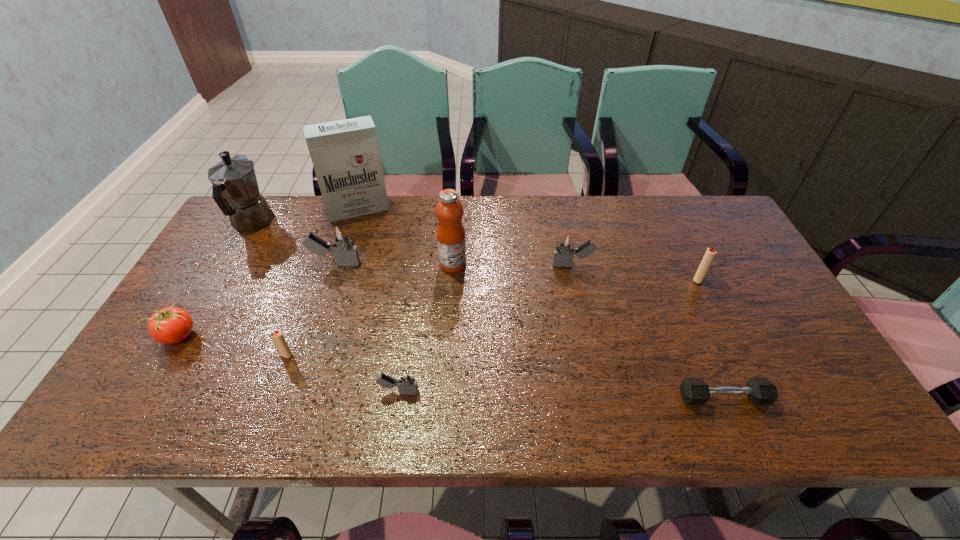
Where is `the fourth farthest igniter`? This screenshot has height=540, width=960. the fourth farthest igniter is located at coordinates tap(277, 337).

Locate an element on the screen. Image resolution: width=960 pixels, height=540 pixels. the left red igniter is located at coordinates (277, 337).

I want to click on the third igniter from right to left, so [406, 382].

Find the location of a particular element. the nearest gray igniter is located at coordinates (406, 382).

The width and height of the screenshot is (960, 540). What are the coordinates of `tomato` in the screenshot? It's located at (171, 325).

The height and width of the screenshot is (540, 960). I want to click on dumbbell, so click(694, 391).

In order to click on free space located 0.400m on the right of the cigarette case in this screenshot , I will do `click(510, 209)`.

The width and height of the screenshot is (960, 540). Identify the location of free space located on the front label of the fourth object from right to left. (504, 264).

You are a GUI agent. You are given a task and a screenshot of the screen. Output one action in this format:
    pyautogui.click(x=<x>, y=<y>)
    Task: Click on the vacant space located 0.190m on the left of the leftmost gray igniter
    
    Given the screenshot: What is the action you would take?
    pyautogui.click(x=246, y=264)

You are a GUI agent. You are given a task and a screenshot of the screen. Output one action in this format:
    pyautogui.click(x=<x>, y=<y>)
    Task: Click on the vacant space situated on the left of the rightmost gray igniter
    Image resolution: width=960 pixels, height=540 pixels.
    Given the screenshot: What is the action you would take?
    pyautogui.click(x=490, y=265)